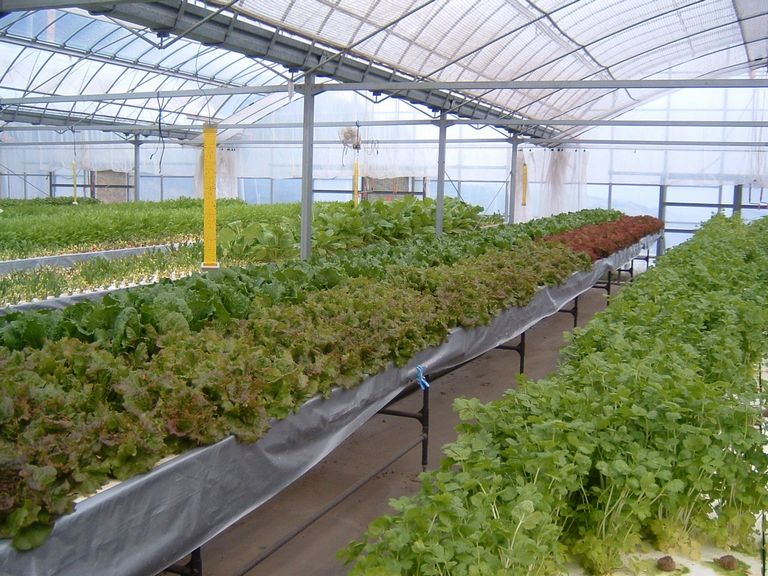
Locate an element on the screen. silver tablecloths is located at coordinates (216, 483), (97, 255), (101, 291).